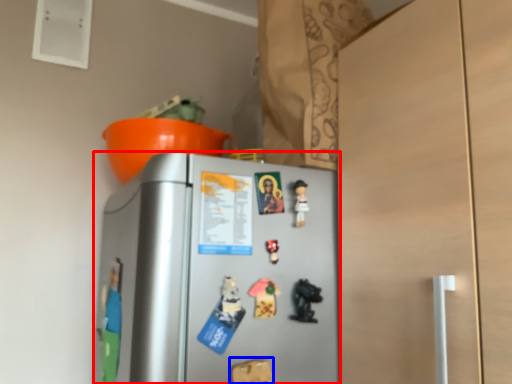
Question: Which object appears farthest to the camera in this image, refrigerator (highlighted by a red box) or toy (highlighted by a blue box)?

Choices:
 (A) refrigerator
 (B) toy

Answer: (B)